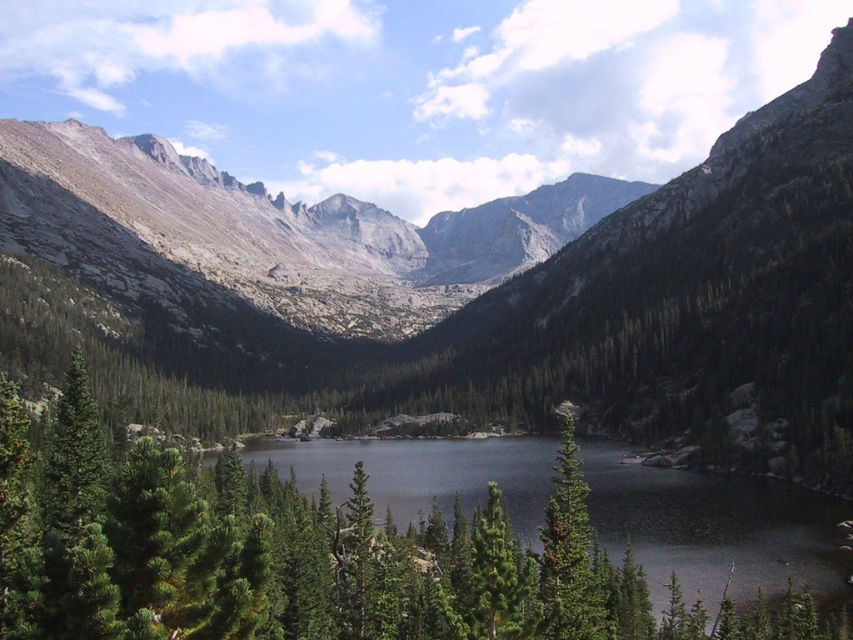
You are standing at the edge of the lake in the serene mountainous landscape. You notice a point marked at coordinates (494, 284). What is the nature of the terrain at that point?

The point at coordinates (494, 284) indicates smooth gray rock at center.

Based on the scene description, what is the 2D coordinate of the smooth dark water at center?

The smooth dark water at center is located at the 2D coordinate point of (712, 525).